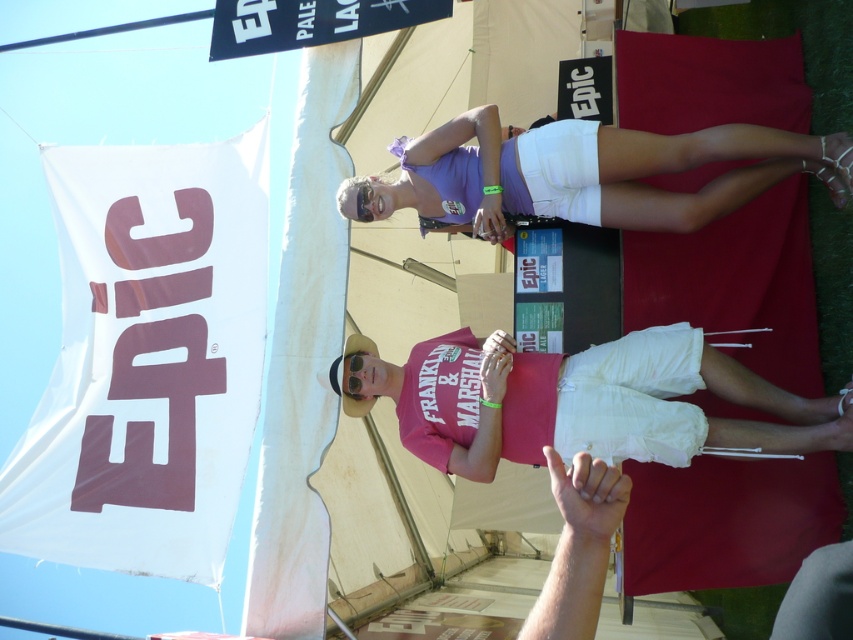
You are a photographer at the event and want to capture a photo of the pink cotton shirt at center and the purple fabric shorts at upper center. The camera you are using has a minimum focusing distance of 60 centimeters. Will you be able to take a clear photo of both items at the same time?

The pink cotton shirt at center and the purple fabric shorts at upper center are 59.37 centimeters apart from each other. Since the minimum focusing distance is 60 centimeters, the camera cannot focus on both items simultaneously because they are closer than the required distance.

You are organizing a clothing display and need to arrange the pink cotton shirt at center and the purple fabric shorts at upper center on a mannequin. Which item should you place first to ensure proper layering?

The pink cotton shirt at center should be placed first since it is thinner than the purple fabric shorts at upper center, allowing the thicker shorts to be layered over it if needed.

You are at an outdoor event under a clear blue sky and see a pink cotton shirt at center and a purple fabric shorts at upper center. Which object is taller?

The pink cotton shirt at center is taller than the purple fabric shorts at upper center.